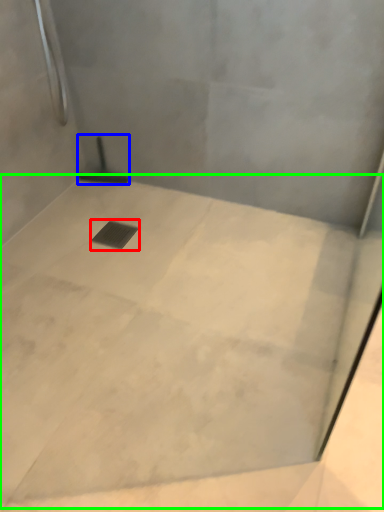
Question: Considering the real-world distances, which object is closest to drain (highlighted by a red box)? shower (highlighted by a blue box) or concrete (highlighted by a green box).

Choices:
 (A) shower
 (B) concrete

Answer: (A)